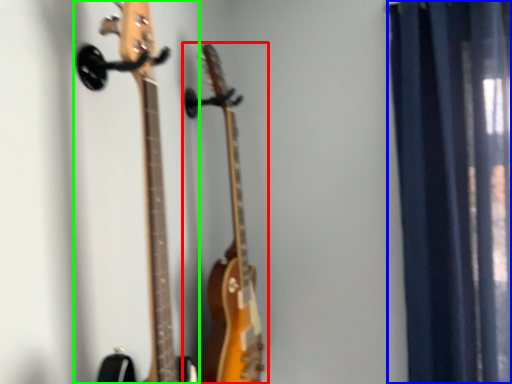
Question: Which object is the closest to the guitar (highlighted by a red box)? Choose among these: curtain (highlighted by a blue box) or guitar (highlighted by a green box).

Choices:
 (A) curtain
 (B) guitar

Answer: (B)